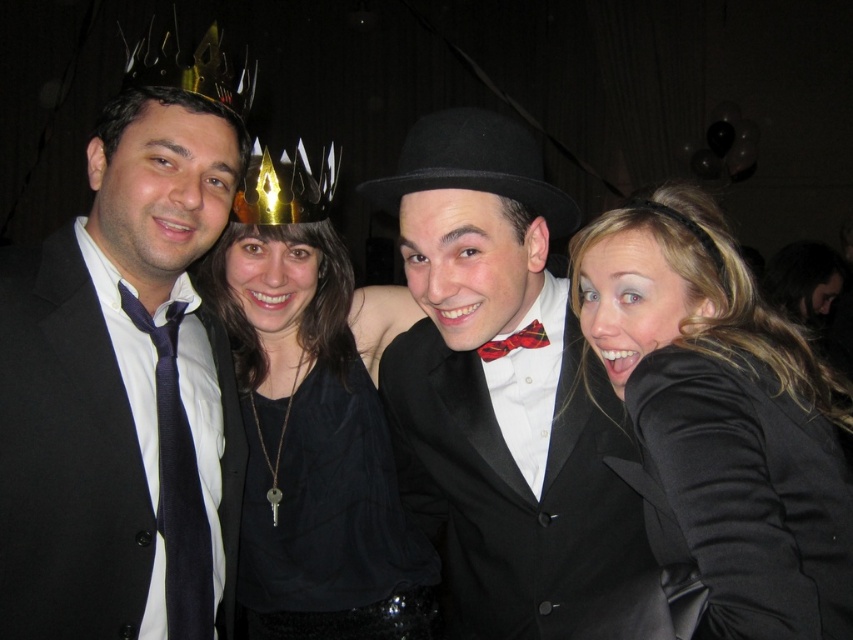
You are a photographer at the event and want to adjust the lighting to highlight both the black satin bow tie at center and the black fabric shirt at center. Since both are black, how can you ensure the bow tie stands out more than the shirt?

The black satin bow tie at center is located above the black fabric shirt at center. By directing a subtle spotlight towards the upper area where the bow tie is positioned, you can create a slight contrast in brightness, making the bow tie stand out more than the shirt below it.

You are a photographer at a formal event. You need to adjust the lighting to ensure both the matte black tie at left and the plaid fabric bow tie at center are visible. Considering their size difference, which tie might require more focused lighting to stand out?

The plaid fabric bow tie at center is smaller in size compared to the matte black tie at left, so it might require more focused lighting to ensure it stands out clearly in the photograph.